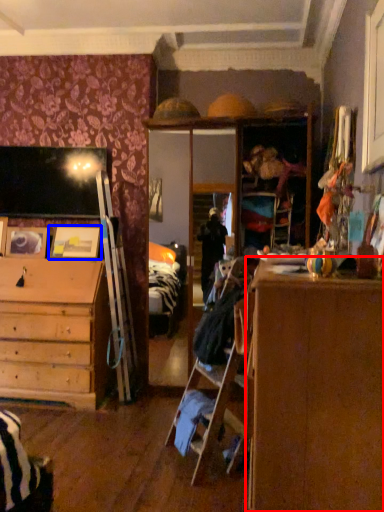
Question: Which of the following is the closest to the observer, cabinetry (highlighted by a red box) or picture frame (highlighted by a blue box)?

Choices:
 (A) cabinetry
 (B) picture frame

Answer: (A)